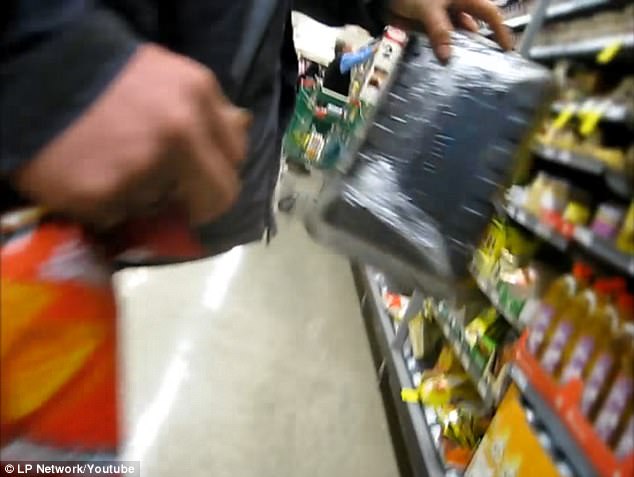
Find the location of a particular element. floor is located at coordinates (287, 372).